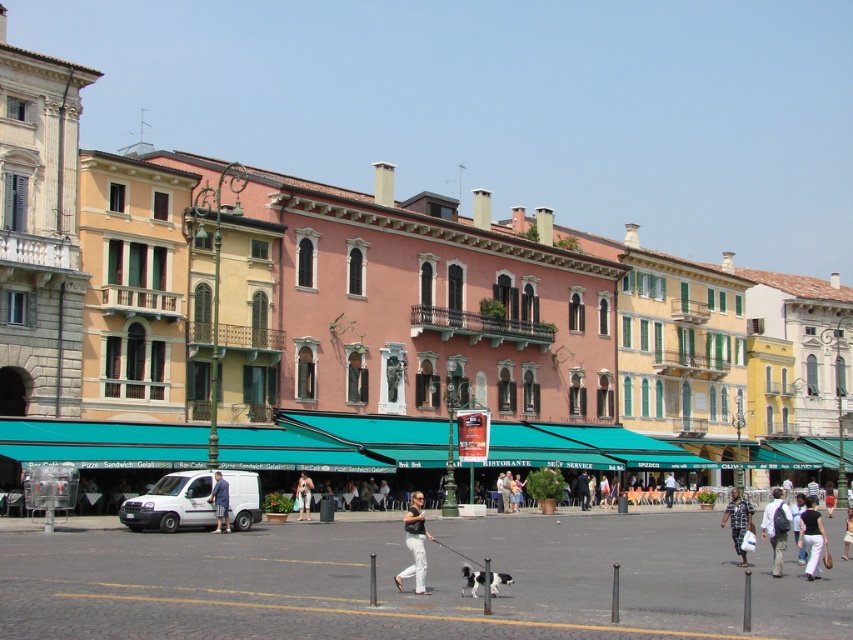
Can you confirm if blue denim jeans at center is smaller than white cotton shirt at center?

Incorrect, blue denim jeans at center is not smaller in size than white cotton shirt at center.

Who is taller, blue denim jeans at center or white cotton shirt at center?

blue denim jeans at center is taller.

At what (x,y) coordinates should I click in order to perform the action: click on blue denim jeans at center. Please return your answer as a coordinate pair (x, y). This screenshot has width=853, height=640. Looking at the image, I should click on (219, 500).

In order to click on blue denim jeans at center in this screenshot , I will do `click(219, 500)`.

This screenshot has width=853, height=640. What do you see at coordinates (811, 538) in the screenshot? I see `white cotton pants at lower right` at bounding box center [811, 538].

Is white cotton pants at lower right below plaid shirt at center?

Incorrect, white cotton pants at lower right is not positioned below plaid shirt at center.

Who is more distant from viewer, (810, 538) or (740, 497)?

The point (740, 497) is behind.

Image resolution: width=853 pixels, height=640 pixels. Identify the location of white cotton pants at lower right. (811, 538).

The width and height of the screenshot is (853, 640). What do you see at coordinates (776, 529) in the screenshot?
I see `light brown backpack at lower right` at bounding box center [776, 529].

Is light brown backpack at lower right above plaid shirt at center?

Indeed, light brown backpack at lower right is positioned over plaid shirt at center.

Is point (780, 541) in front of point (746, 502)?

Yes, point (780, 541) is closer to viewer.

Image resolution: width=853 pixels, height=640 pixels. In order to click on light brown backpack at lower right in this screenshot , I will do `click(776, 529)`.